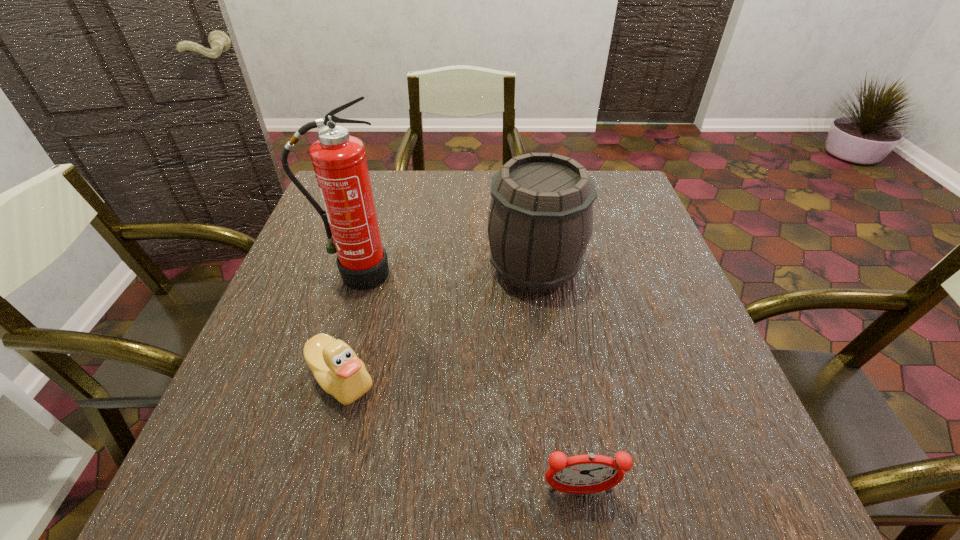
In the image, there is a desktop. What are the coordinates of `vacant space at the far edge` in the screenshot? It's located at (443, 173).

Where is `free space at the left edge of the desktop`? free space at the left edge of the desktop is located at coordinates (257, 386).

The image size is (960, 540). Identify the location of vacant area at the right edge. (616, 227).

Image resolution: width=960 pixels, height=540 pixels. I want to click on vacant space at the near left corner, so click(x=271, y=472).

Image resolution: width=960 pixels, height=540 pixels. Find the location of `vacant space at the far right corner of the desktop`. vacant space at the far right corner of the desktop is located at coordinates (646, 213).

This screenshot has width=960, height=540. Identify the location of vacant space at the near right corner of the desktop. (689, 493).

I want to click on vacant space that's between the nearest object and the tallest object, so click(x=468, y=383).

Locate an element on the screen. This screenshot has height=540, width=960. free area in between the wine bucket and the second nearest object is located at coordinates (438, 323).

Identify the location of empty location between the wine bucket and the duck. (438, 323).

Where is `vacant space that's between the nearest object and the fire extinguisher`? vacant space that's between the nearest object and the fire extinguisher is located at coordinates (468, 383).